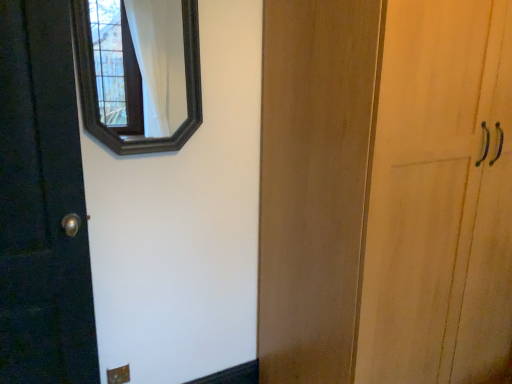
At what (x,y) coordinates should I click in order to perform the action: click on dark gray wooden mirror at upper left. Please return your answer as a coordinate pair (x, y). Looking at the image, I should click on (139, 65).

Image resolution: width=512 pixels, height=384 pixels. What do you see at coordinates (139, 65) in the screenshot?
I see `dark gray wooden mirror at upper left` at bounding box center [139, 65].

You are a GUI agent. You are given a task and a screenshot of the screen. Output one action in this format:
    pyautogui.click(x=<x>, y=<y>)
    Task: Click on the dark gray wooden mirror at upper left
    
    Given the screenshot: What is the action you would take?
    click(x=139, y=65)